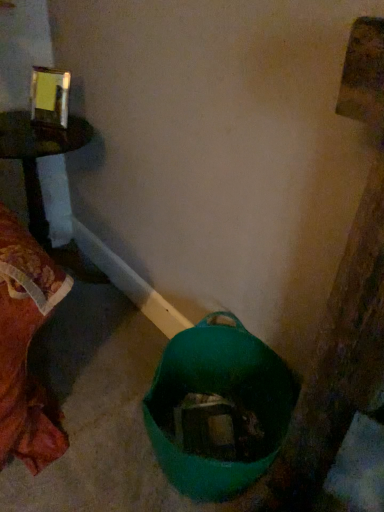
Find the location of a particular element. The height and width of the screenshot is (512, 384). teal fabric bag at lower center is located at coordinates (223, 398).

Image resolution: width=384 pixels, height=512 pixels. Describe the element at coordinates (223, 398) in the screenshot. I see `teal fabric bag at lower center` at that location.

Find the location of `teal fabric bag at lower center`. teal fabric bag at lower center is located at coordinates (223, 398).